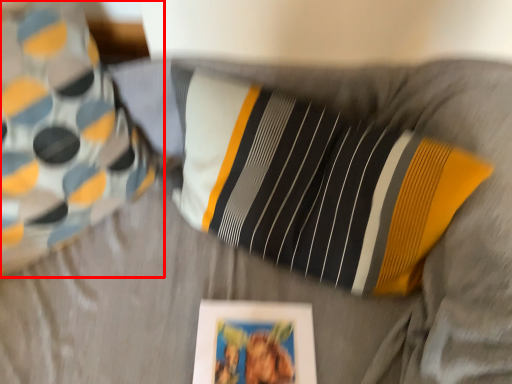
Question: From the image's perspective, where is pillow (annotated by the red box) located relative to picture frame?

Choices:
 (A) above
 (B) below

Answer: (A)